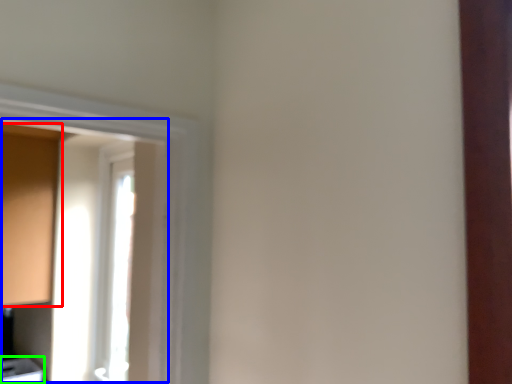
Question: Which object is positioned closest to cabinetry (highlighted by a red box)? Select from window screen (highlighted by a blue box) and cabinetry (highlighted by a green box).

Choices:
 (A) window screen
 (B) cabinetry

Answer: (A)